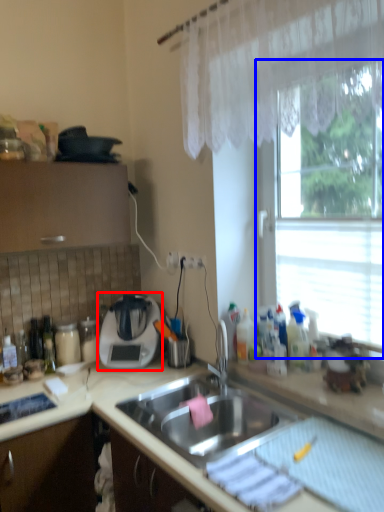
Question: Which point is closer to the camera, appliance (highlighted by a red box) or window (highlighted by a blue box)?

Choices:
 (A) appliance
 (B) window

Answer: (B)